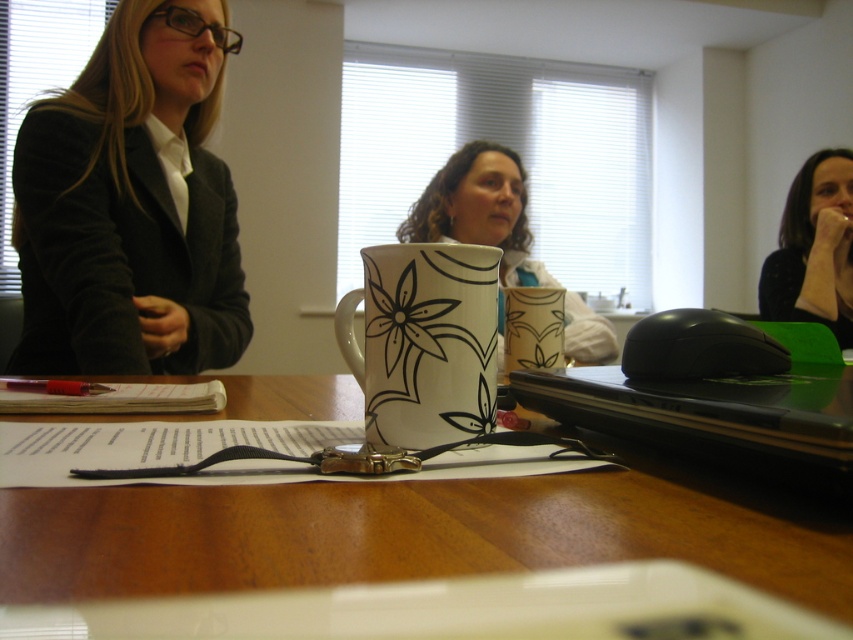
Between wooden table at center and matte black blazer at left, which one is positioned higher?

matte black blazer at left is higher up.

Is point (682, 509) positioned in front of point (129, 170)?

Yes, point (682, 509) is closer to viewer.

This screenshot has height=640, width=853. Identify the location of wooden table at center. (405, 534).

Between point (526, 392) and point (780, 301), which one is positioned behind?

The point (780, 301) is behind.

Does black plastic laptop at center have a lesser height compared to black dotted shirt at upper right?

Yes, black plastic laptop at center is shorter than black dotted shirt at upper right.

Is point (764, 451) positioned after point (782, 312)?

That is False.

Locate an element on the screen. black plastic laptop at center is located at coordinates (709, 413).

Between matte black blazer at left and white ceramic mug at center, which one appears on the right side from the viewer's perspective?

white ceramic mug at center

Is matte black blazer at left closer to camera compared to white ceramic mug at center?

That is False.

Between point (192, 12) and point (434, 356), which one is positioned behind?

Point (192, 12)

In order to click on matte black blazer at left in this screenshot , I will do `click(131, 204)`.